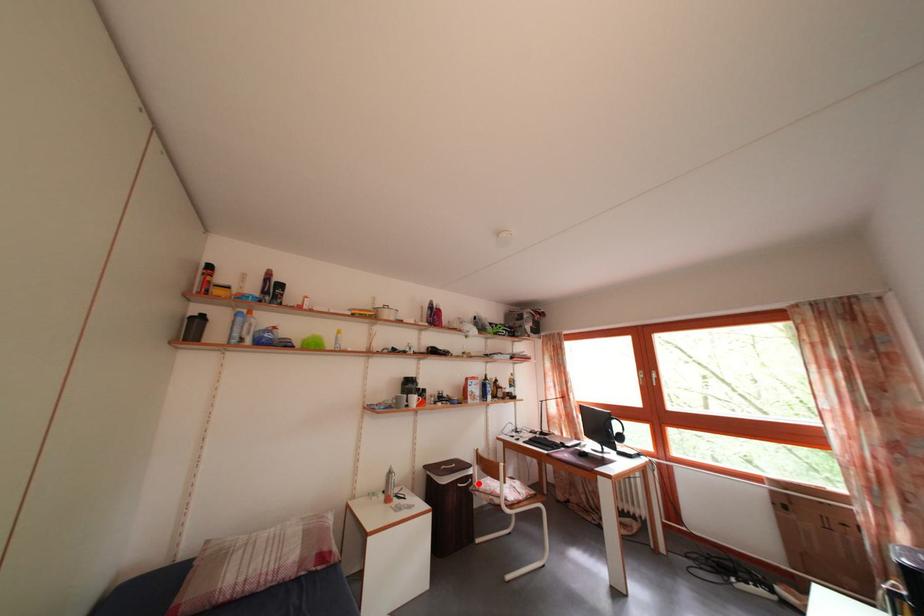
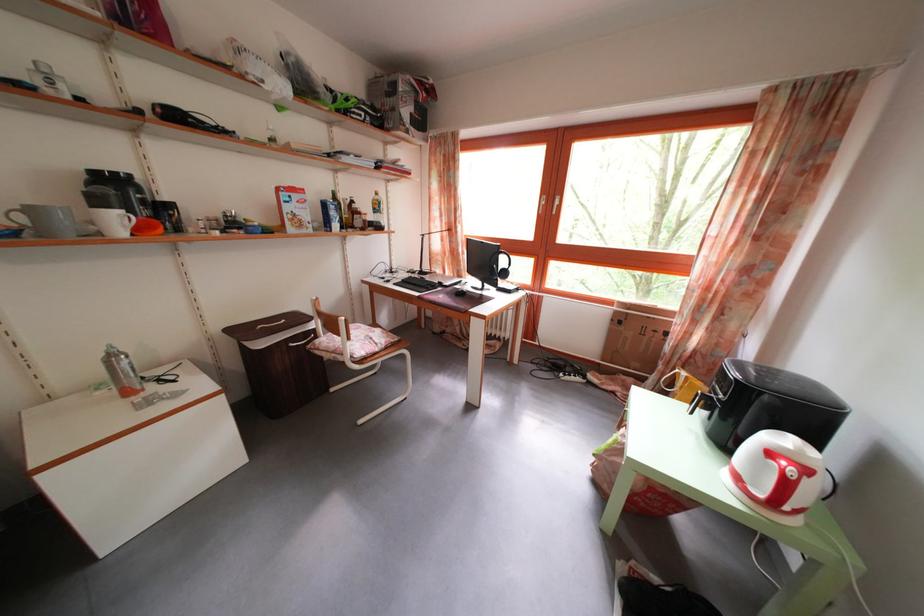
Where in the second image is the point corresponding to the highlighted location from the first image?

(322, 339)